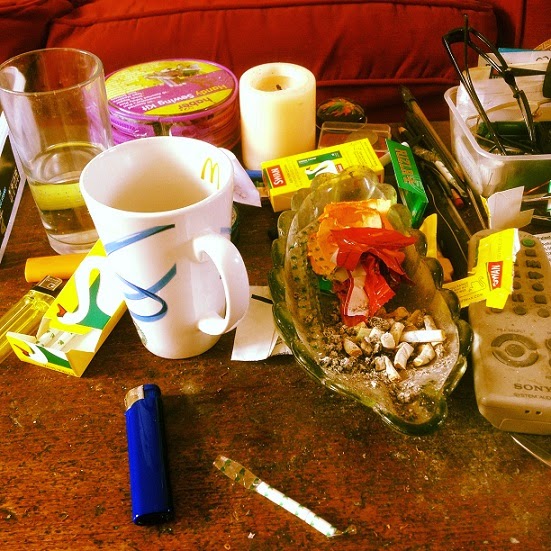
At what (x,y) coordinates should I click in order to perform the action: click on plastic container. Please return your answer as a coordinate pair (x, y). This screenshot has width=551, height=551. Looking at the image, I should click on (488, 166).